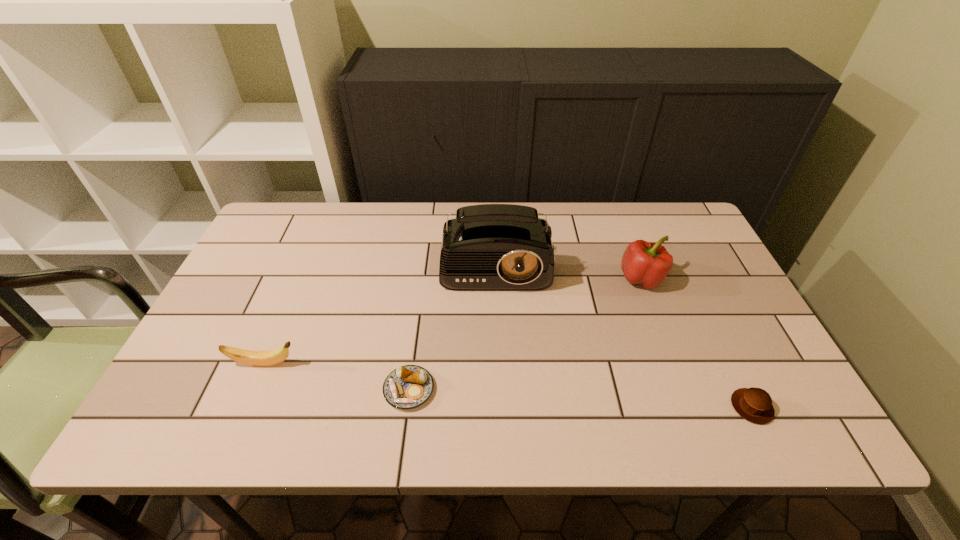
The width and height of the screenshot is (960, 540). In the image, there is a desktop. What are the coordinates of `vacant space at the near edge` in the screenshot? It's located at (420, 437).

In order to click on free location at the left edge of the desktop in this screenshot , I will do `click(265, 252)`.

In the image, there is a desktop. At what (x,y) coordinates should I click in order to perform the action: click on vacant space at the right edge. Please return your answer as a coordinate pair (x, y). This screenshot has height=540, width=960. Looking at the image, I should click on (784, 399).

Identify the location of vacant space at the far right corner. The width and height of the screenshot is (960, 540). (674, 210).

The image size is (960, 540). In order to click on unoccupied area between the shortest object and the leftmost object in this screenshot , I will do `click(337, 377)`.

Locate an element on the screen. This screenshot has width=960, height=540. free space between the shortest object and the second tallest object is located at coordinates (525, 334).

Find the location of a particular element. free point between the third shortest object and the pastry is located at coordinates (337, 377).

Identify the location of vacant space in between the rightmost object and the bell pepper. The image size is (960, 540). (696, 343).

The height and width of the screenshot is (540, 960). I want to click on empty space that is in between the tallest object and the fourth object from left to right, so click(568, 266).

Locate an element on the screen. unoccupied area between the radio receiver and the second shortest object is located at coordinates (624, 330).